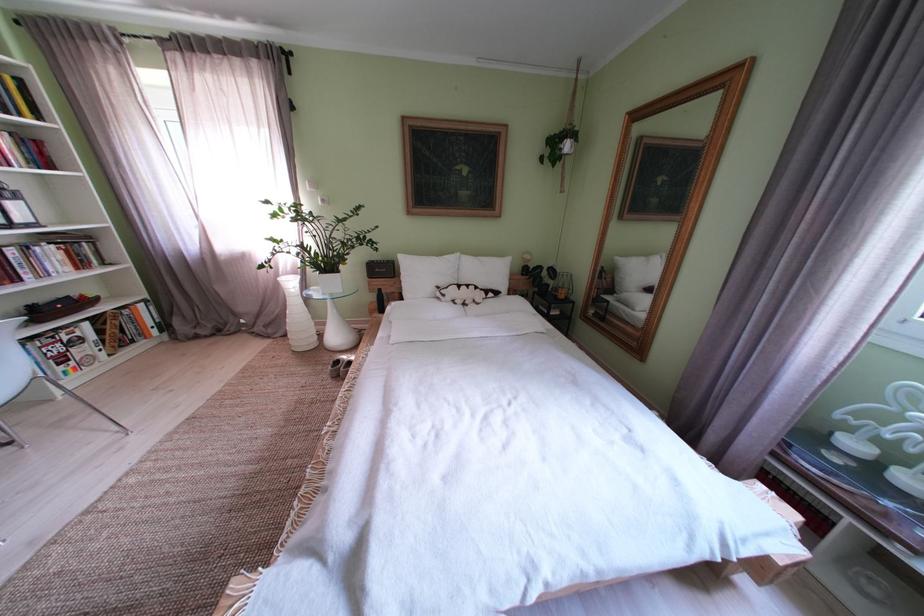
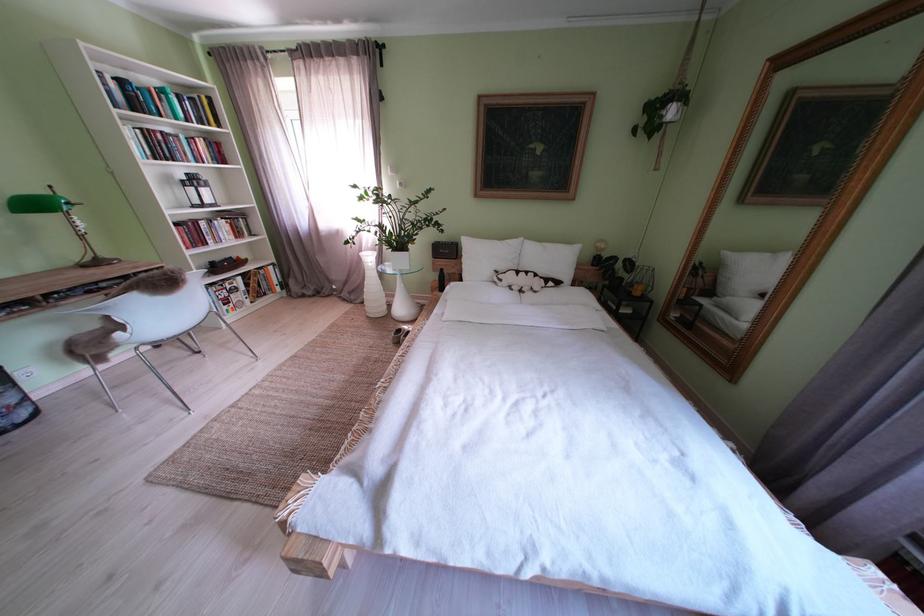
The point at [455,301] is marked in the first image. Where is the corresponding point in the second image?

(512, 285)